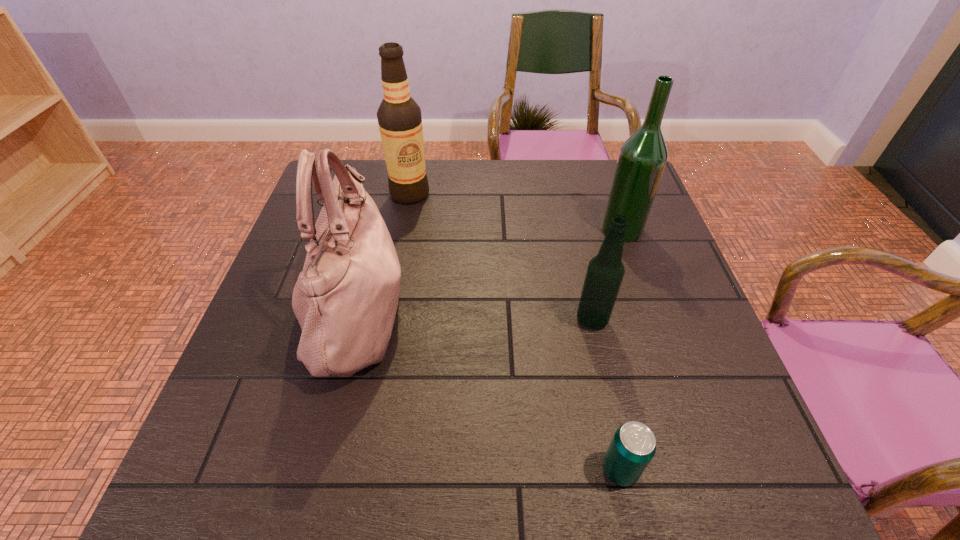
Identify the location of vacant region that satisfies the following two spatial constraints: 1. on the label of the farthest alcohol; 2. on the left side of the nearest alcohol. The height and width of the screenshot is (540, 960). (387, 320).

Find the location of `vacant space that satisfies the following two spatial constraints: 1. at the front of the handbag with handles; 2. on the right side of the shortest object`. vacant space that satisfies the following two spatial constraints: 1. at the front of the handbag with handles; 2. on the right side of the shortest object is located at coordinates (315, 469).

Locate an element on the screen. vacant space that satisfies the following two spatial constraints: 1. on the label of the farthest object; 2. on the left side of the nearest alcohol is located at coordinates (387, 320).

Image resolution: width=960 pixels, height=540 pixels. What are the coordinates of `free space in the image that satisfies the following two spatial constraints: 1. on the label of the shortest object; 2. on the right side of the leftmost alcohol` in the screenshot? It's located at (359, 469).

This screenshot has height=540, width=960. Identify the location of free space that satisfies the following two spatial constraints: 1. at the front of the handbag with handles; 2. on the right side of the second alcohol from left to right. (353, 320).

Where is `free space that satisfies the following two spatial constraints: 1. on the label of the farthest object; 2. at the front of the handbag with handles`? This screenshot has width=960, height=540. free space that satisfies the following two spatial constraints: 1. on the label of the farthest object; 2. at the front of the handbag with handles is located at coordinates (389, 310).

This screenshot has height=540, width=960. I want to click on vacant point that satisfies the following two spatial constraints: 1. on the back side of the beer can; 2. at the front of the handbag with handles, so click(586, 310).